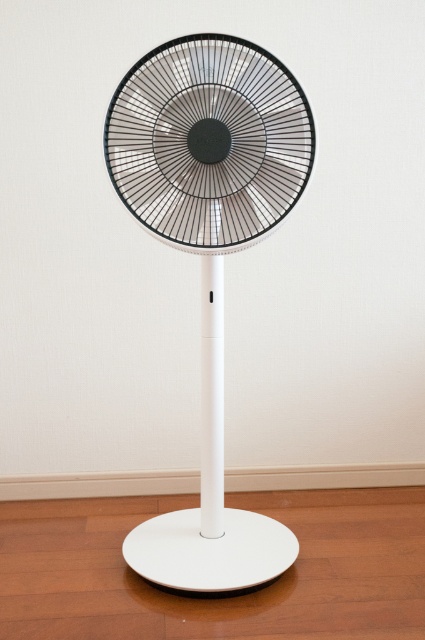
You are standing in a room with two fans. You see the white plastic fan at center and the black matte fan at center. Which fan is positioned more to the left side of the room?

The white plastic fan at center is positioned more to the left side of the room compared to the black matte fan at center.

You are trying to decide which fan to buy for your room. You notice both the white plastic fan at center and the black matte fan at center in the image. Based on their positions, which one is closer to the wall?

Both the white plastic fan at center and the black matte fan at center are positioned at the same central area, but since they are 2.32 inches apart, it is unclear which one is closer to the wall without additional spatial information about their exact placement relative to the wall.

You are standing in front of the modern standing fan shown in the image. There is a point at coordinates point [141,218] that you want to reach. Can you estimate whether you can touch this point without moving closer to the fan?

The point [141,218] is 4.63 feet away from the camera, so you cannot touch it without moving closer to the fan since it is beyond your current reach.